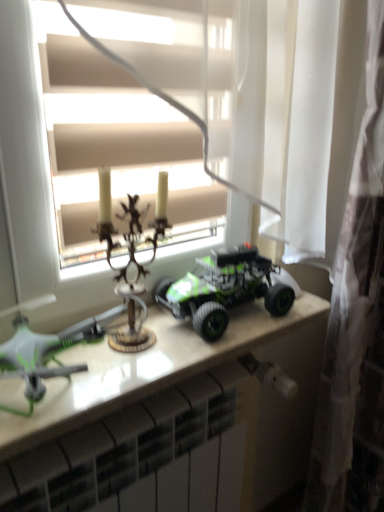
The width and height of the screenshot is (384, 512). What do you see at coordinates (224, 289) in the screenshot?
I see `green matte toy truck at center, positioned as the 3th toy in left-to-right order` at bounding box center [224, 289].

Locate an element on the screen. green matte drone at left, arranged as the 1th toy when viewed from the left is located at coordinates (47, 353).

What do you see at coordinates (146, 369) in the screenshot? The image size is (384, 512). I see `white glossy table at center` at bounding box center [146, 369].

Where is `green matte toy truck at center, the first toy positioned from the right`? green matte toy truck at center, the first toy positioned from the right is located at coordinates (224, 289).

Which is more to the right, white sheer curtain at right or matte white window at center?

From the viewer's perspective, white sheer curtain at right appears more on the right side.

Looking at this image, looking at their sizes, would you say white sheer curtain at right is wider or thinner than matte white window at center?

In the image, white sheer curtain at right appears to be wider than matte white window at center.

Is point (371, 111) farther from viewer compared to point (77, 260)?

Yes, point (371, 111) is farther from viewer.

Between white sheer curtain at right and matte white window at center, which one has more height?

white sheer curtain at right.

Which is more to the left, white sheer curtain at right or green matte toy truck at center, positioned as the 3th toy in left-to-right order?

From the viewer's perspective, green matte toy truck at center, positioned as the 3th toy in left-to-right order, appears more on the left side.

How much distance is there between white sheer curtain at right and green matte toy truck at center, positioned as the 3th toy in left-to-right order?

The distance of white sheer curtain at right from green matte toy truck at center, positioned as the 3th toy in left-to-right order, is 13.05 inches.

From a real-world perspective, relative to green matte toy truck at center, the first toy positioned from the right, is white sheer curtain at right vertically above or below?

In terms of real-world spatial position, white sheer curtain at right is below green matte toy truck at center, the first toy positioned from the right.

Between white sheer curtain at right and green matte toy truck at center, the first toy positioned from the right, which one has larger size?

Bigger between the two is white sheer curtain at right.

Is matte white window at center inside white glossy table at center?

No, matte white window at center is not a part of white glossy table at center.

Considering the positions of objects white glossy table at center and matte white window at center in the image provided, who is more to the left, white glossy table at center or matte white window at center?

matte white window at center is more to the left.

At what (x,y) coordinates should I click in order to perform the action: click on window located in front of the white glossy table at center. Please return your answer as a coordinate pair (x, y). Looking at the image, I should click on (114, 143).

Relative to matte white window at center, is white glossy table at center in front or behind?

Clearly, white glossy table at center is behind matte white window at center.

Find the location of a particular element. Image resolution: width=384 pixels, height=512 pixels. curtain above the white glossy radiator at lower center (from a real-world perspective) is located at coordinates (356, 323).

Is white sheer curtain at right surrounding white glossy radiator at lower center?

No, white glossy radiator at lower center is not a part of white sheer curtain at right.

From the image's perspective, is white sheer curtain at right under white glossy radiator at lower center?

No.

Considering the relative positions of white sheer curtain at right and white glossy radiator at lower center in the image provided, is white sheer curtain at right to the left of white glossy radiator at lower center from the viewer's perspective?

No, white sheer curtain at right is not to the left of white glossy radiator at lower center.

Could you tell me if white sheer curtain at right is facing white glossy table at center?

No, white sheer curtain at right is not aimed at white glossy table at center.

From the image's perspective, who appears lower, white sheer curtain at right or white glossy table at center?

white glossy table at center, from the image's perspective.

Can white glossy table at center be found inside white sheer curtain at right?

Definitely not — white glossy table at center is not inside white sheer curtain at right.

Which object is wider, antique brass candlestick at center, marked as the 2th toy in a left-to-right arrangement, or white glossy table at center?

white glossy table at center.

This screenshot has width=384, height=512. Identify the location of table below the antique brass candlestick at center, marked as the 2th toy in a left-to-right arrangement (from a real-world perspective). (146, 369).

Measure the distance from antique brass candlestick at center, which appears as the second toy when viewed from the right, to white glossy table at center.

14.08 centimeters.

From the image's perspective, is antique brass candlestick at center, which appears as the second toy when viewed from the right, located above or below white glossy table at center?

antique brass candlestick at center, which appears as the second toy when viewed from the right, is situated higher than white glossy table at center in the image.

In the scene shown: Can you confirm if white glossy radiator at lower center is positioned to the right of white glossy table at center?

In fact, white glossy radiator at lower center is to the left of white glossy table at center.

Is white glossy radiator at lower center directly adjacent to white glossy table at center?

No, white glossy radiator at lower center is not beside white glossy table at center.

Between white glossy radiator at lower center and white glossy table at center, which one has more height?

white glossy radiator at lower center.

Considering their positions, is white glossy radiator at lower center located in front of or behind white glossy table at center?

In the image, white glossy radiator at lower center appears behind white glossy table at center.

Image resolution: width=384 pixels, height=512 pixels. Find the location of `window on the left of white sheer curtain at right`. window on the left of white sheer curtain at right is located at coordinates (114, 143).

I want to click on toy behind the white sheer curtain at right, so click(224, 289).

From the image, which object appears to be nearer to antique brass candlestick at center, marked as the 2th toy in a left-to-right arrangement, white glossy radiator at lower center or green matte drone at left, arranged as the 1th toy when viewed from the left?

green matte drone at left, arranged as the 1th toy when viewed from the left, is positioned closer to the anchor antique brass candlestick at center, marked as the 2th toy in a left-to-right arrangement.

From the image, which object appears to be nearer to matte white window at center, antique brass candlestick at center, marked as the 2th toy in a left-to-right arrangement, or white glossy table at center?

antique brass candlestick at center, marked as the 2th toy in a left-to-right arrangement, is positioned closer to the anchor matte white window at center.

Which object lies nearer to the anchor point green matte drone at left, arranged as the 1th toy when viewed from the left, white glossy radiator at lower center or antique brass candlestick at center, which appears as the second toy when viewed from the right?

Among the two, antique brass candlestick at center, which appears as the second toy when viewed from the right, is located nearer to green matte drone at left, arranged as the 1th toy when viewed from the left.

Which object lies nearer to the anchor point matte white window at center, white glossy radiator at lower center or green matte toy truck at center, positioned as the 3th toy in left-to-right order?

The object closer to matte white window at center is green matte toy truck at center, positioned as the 3th toy in left-to-right order.

In the scene shown: When comparing their distances from white glossy radiator at lower center, does white glossy table at center or white sheer curtain at right seem closer?

The object closer to white glossy radiator at lower center is white glossy table at center.

Considering their positions, is green matte drone at left, which ranks as the third toy in right-to-left order, positioned further to white glossy table at center than matte white window at center?

Among the two, matte white window at center is located further to white glossy table at center.

Which object lies further to the anchor point matte white window at center, white glossy table at center or white sheer curtain at right?

Based on the image, white sheer curtain at right appears to be further to matte white window at center.

Considering their positions, is antique brass candlestick at center, marked as the 2th toy in a left-to-right arrangement, positioned further to white sheer curtain at right than white glossy radiator at lower center?

antique brass candlestick at center, marked as the 2th toy in a left-to-right arrangement, is positioned further to the anchor white sheer curtain at right.

This screenshot has height=512, width=384. In order to click on table between antique brass candlestick at center, marked as the 2th toy in a left-to-right arrangement, and white sheer curtain at right from left to right in this screenshot , I will do `click(146, 369)`.

Find the location of a particular element. This screenshot has width=384, height=512. table located between white glossy radiator at lower center and white sheer curtain at right in the left-right direction is located at coordinates (146, 369).

The height and width of the screenshot is (512, 384). In order to click on curtain between matte white window at center and white glossy radiator at lower center vertically in this screenshot , I will do `click(356, 323)`.

You are a GUI agent. You are given a task and a screenshot of the screen. Output one action in this format:
    pyautogui.click(x=<x>, y=<y>)
    Task: Click on the radiator situated between antique brass candlestick at center, which appears as the second toy when viewed from the right, and white sheer curtain at right from left to right
    
    Given the screenshot: What is the action you would take?
    pyautogui.click(x=140, y=458)